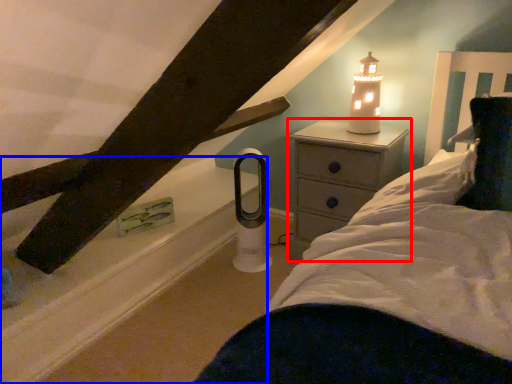
Question: Which object appears closest to the camera in this image, nightstand (highlighted by a red box) or window sill (highlighted by a blue box)?

Choices:
 (A) nightstand
 (B) window sill

Answer: (B)